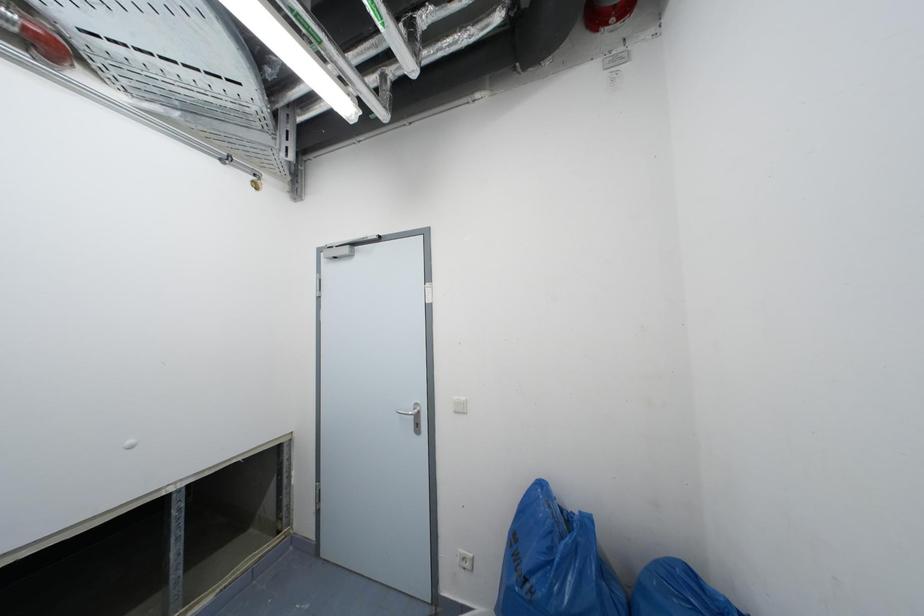
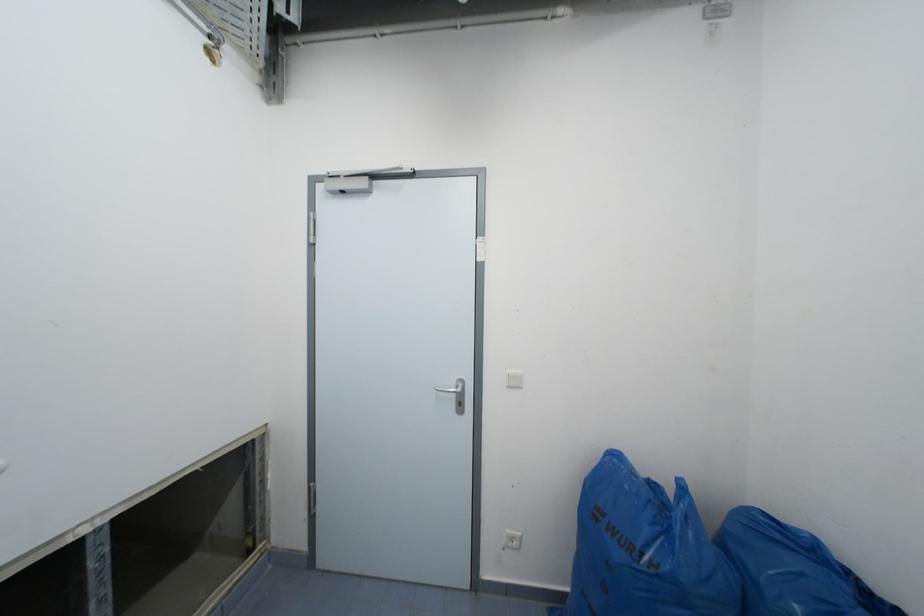
What movement of the cameraman would produce the second image?

The cameraman walked toward left, forward.